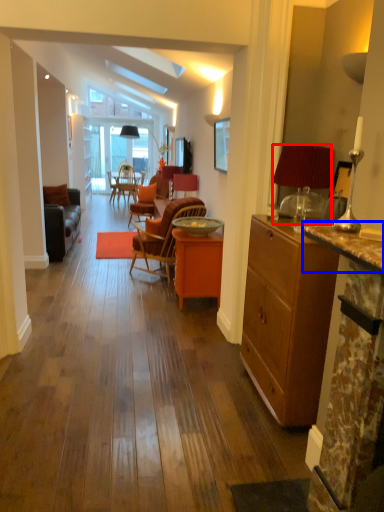
Question: Which object appears closest to the camera in this image, lamp (highlighted by a red box) or counter top (highlighted by a blue box)?

Choices:
 (A) lamp
 (B) counter top

Answer: (B)